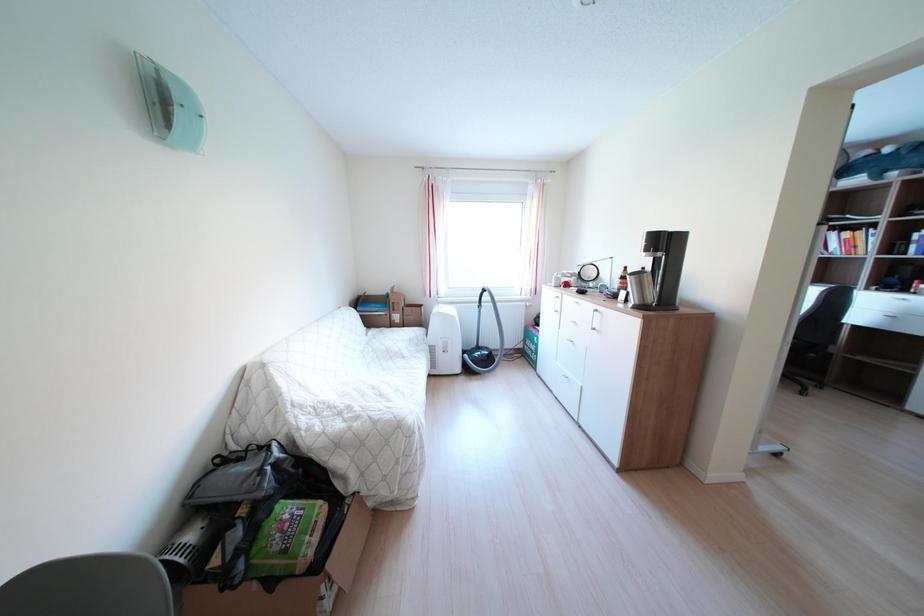
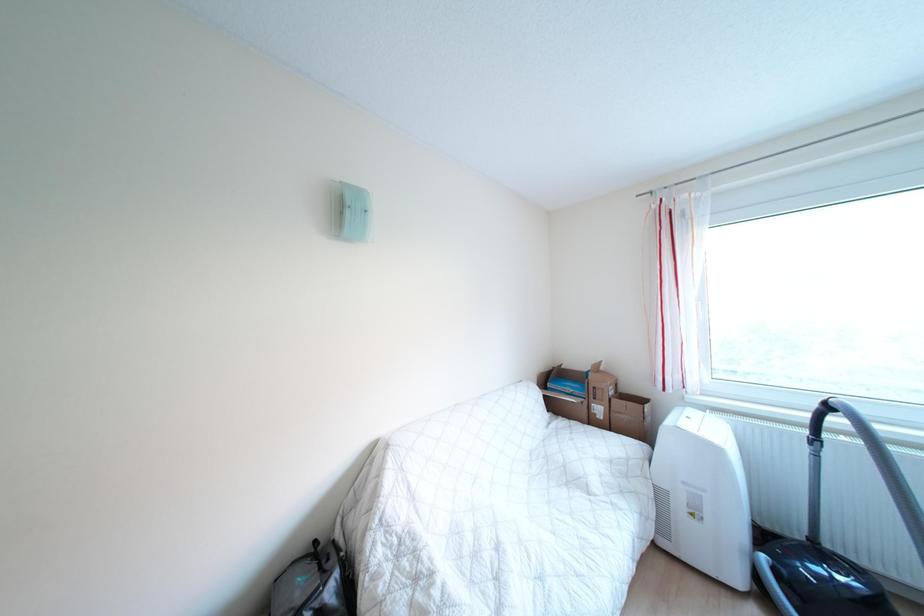
Question: The first image is from the beginning of the video and the second image is from the end. How did the camera likely rotate when shooting the video?

Choices:
 (A) Left
 (B) Right
 (C) Up
 (D) Down

Answer: (A)